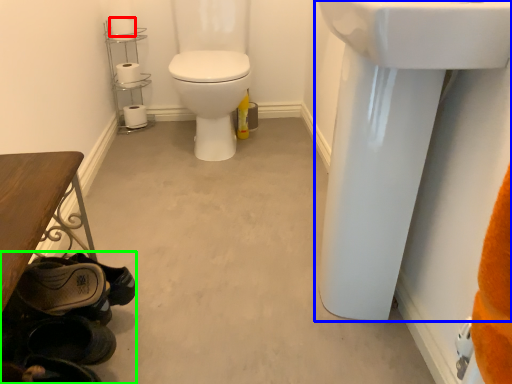
Question: Which object is the closest to the toilet paper (highlighted by a red box)? Choose among these: sink (highlighted by a blue box) or shoe (highlighted by a green box).

Choices:
 (A) sink
 (B) shoe

Answer: (B)